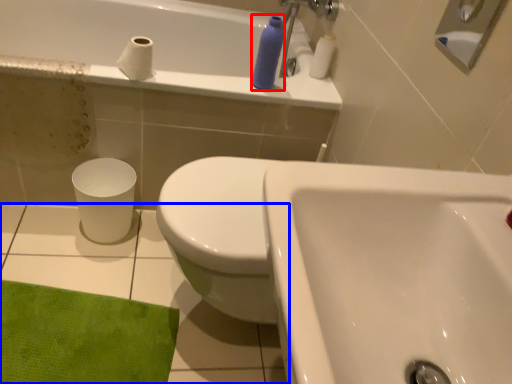
Question: Which object is closer to the camera taking this photo, toiletry (highlighted by a red box) or ceramic tile (highlighted by a blue box)?

Choices:
 (A) toiletry
 (B) ceramic tile

Answer: (B)